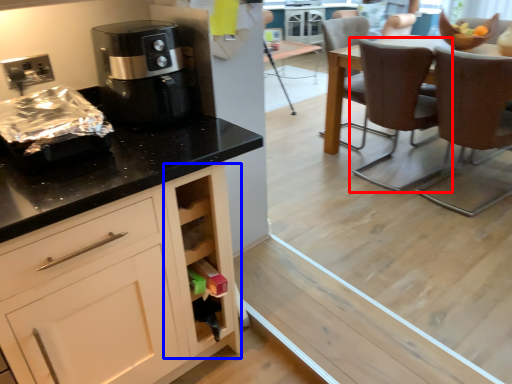
Question: Which of the following is the closest to the observer, chair (highlighted by a red box) or cabinetry (highlighted by a blue box)?

Choices:
 (A) chair
 (B) cabinetry

Answer: (B)